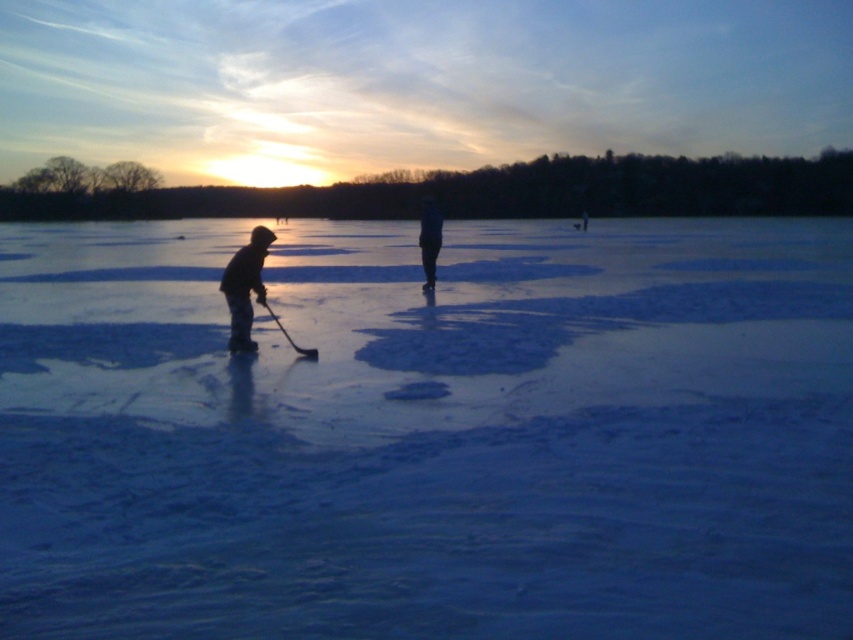
Is dark blue jeans at center thinner than shiny black hockey stick at center?

Yes, dark blue jeans at center is thinner than shiny black hockey stick at center.

Who is higher up, dark blue jeans at center or shiny black hockey stick at center?

dark blue jeans at center is higher up.

Locate an element on the screen. This screenshot has width=853, height=640. dark blue jeans at center is located at coordinates (428, 240).

Is white matte ice at center in front of shiny black hockey stick at center?

Yes, white matte ice at center is in front of shiny black hockey stick at center.

Who is taller, white matte ice at center or shiny black hockey stick at center?

white matte ice at center is taller.

Does point (728, 406) come behind point (287, 340)?

No, (728, 406) is closer to viewer.

Where is `white matte ice at center`? The height and width of the screenshot is (640, 853). white matte ice at center is located at coordinates (428, 433).

Between point (62, 595) and point (254, 248), which one is positioned behind?

The point (254, 248) is more distant.

Find the location of a particular element. white matte ice at center is located at coordinates (428, 433).

Is point (39, 467) in front of point (235, 285)?

Yes, it is in front of point (235, 285).

Locate an element on the screen. The width and height of the screenshot is (853, 640). white matte ice at center is located at coordinates (428, 433).